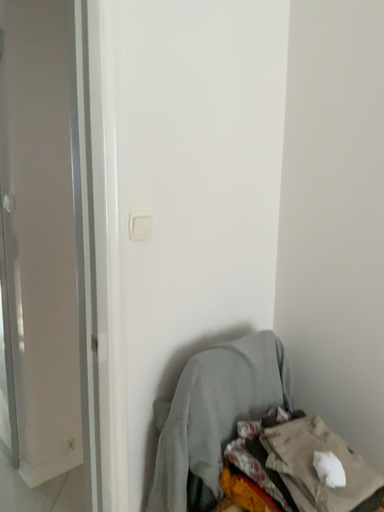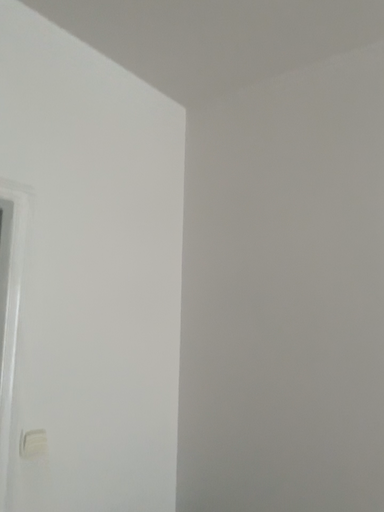
Question: How did the camera likely rotate when shooting the video?

Choices:
 (A) rotated right
 (B) rotated left

Answer: (A)